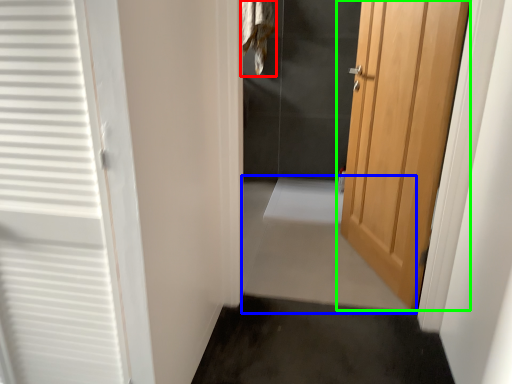
Question: Which is nearer to the laundry (highlighted by a red box)? path (highlighted by a blue box) or door (highlighted by a green box).

Choices:
 (A) path
 (B) door

Answer: (A)